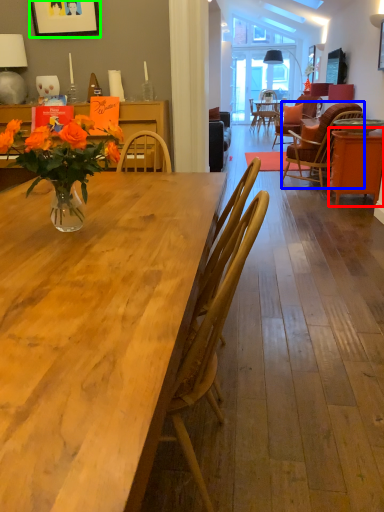
Question: Estimate the real-world distances between objects in this image. Which object is closer to table (highlighted by a red box), chair (highlighted by a blue box) or picture frame (highlighted by a green box)?

Choices:
 (A) chair
 (B) picture frame

Answer: (A)